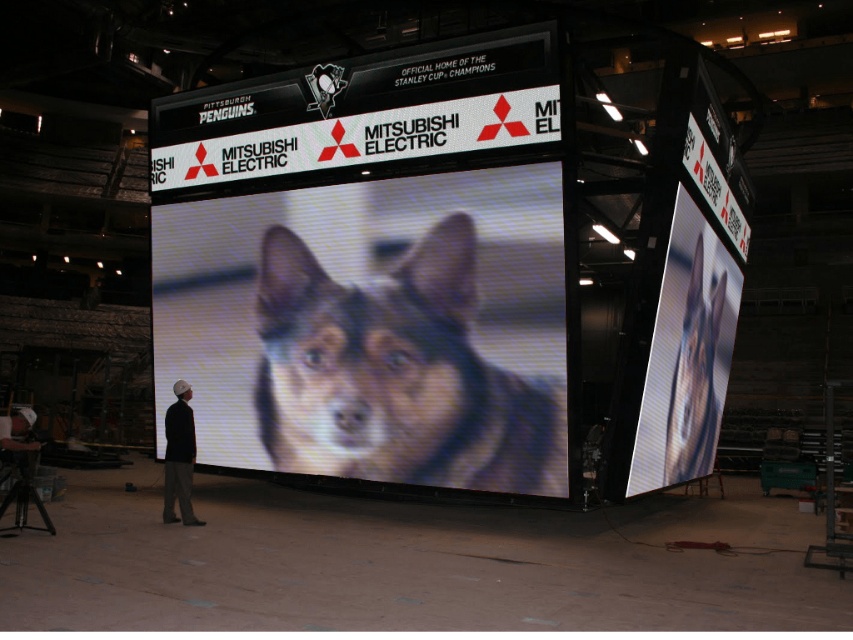
Question: In this image, where is brown fur dog at center located relative to dark gray knit cap at center?

Choices:
 (A) below
 (B) above

Answer: (B)

Question: Among these points, which one is farthest from the camera?

Choices:
 (A) (178, 451)
 (B) (689, 301)

Answer: (B)

Question: Which object is closer to the camera taking this photo?

Choices:
 (A) dark gray knit cap at center
 (B) white plastic sign at upper center
 (C) brown fur dog at center
 (D) shiny digital display at center

Answer: (C)

Question: Which object is positioned closest to the shiny digital display at center?

Choices:
 (A) brown fur dog at center
 (B) dark gray knit cap at center
 (C) white plastic sign at upper center

Answer: (A)

Question: Is white plastic sign at upper center above dark gray knit cap at center?

Choices:
 (A) no
 (B) yes

Answer: (B)

Question: Can you confirm if white plastic sign at upper center is positioned above dark gray knit cap at center?

Choices:
 (A) no
 (B) yes

Answer: (B)